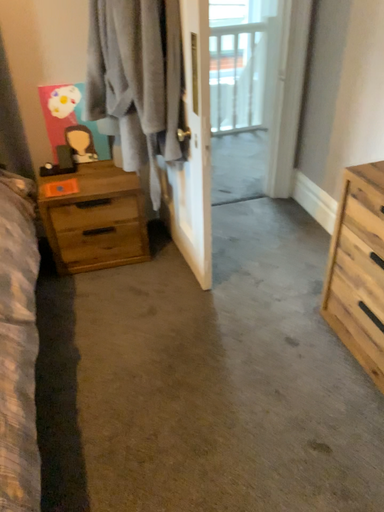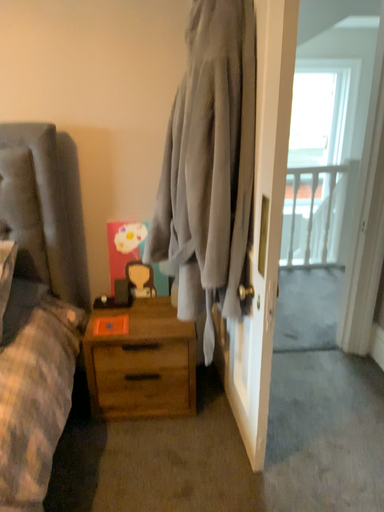
Question: Which way did the camera rotate in the video?

Choices:
 (A) rotated upward
 (B) rotated downward

Answer: (A)